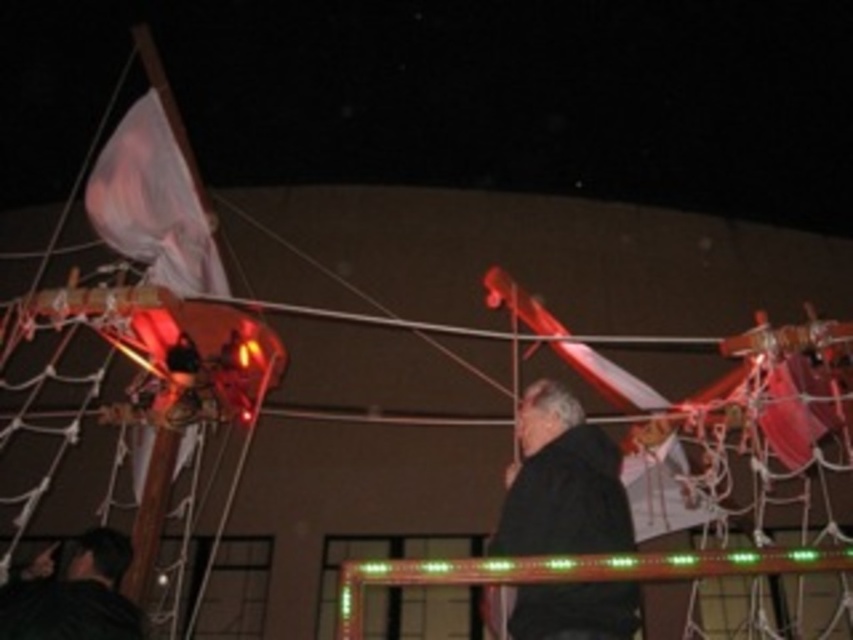
Which of these two, black matte jacket at center or black matte jacket at lower left, stands taller?

black matte jacket at center

Can you confirm if black matte jacket at center is positioned to the left of black matte jacket at lower left?

No, black matte jacket at center is not to the left of black matte jacket at lower left.

Identify the location of black matte jacket at center. This screenshot has height=640, width=853. (561, 481).

Find the location of a particular element. black matte jacket at center is located at coordinates pyautogui.click(x=561, y=481).